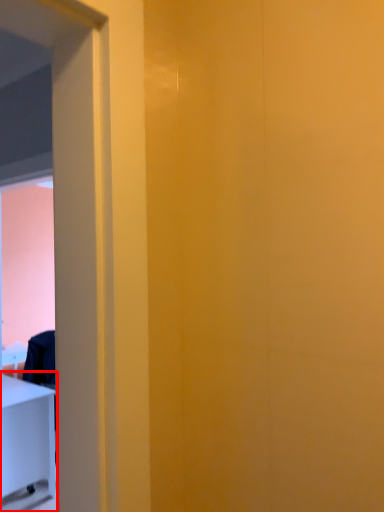
Question: From the image's perspective, what is the correct spatial positioning of furniture (annotated by the red box) in reference to screen door?

Choices:
 (A) below
 (B) above

Answer: (A)